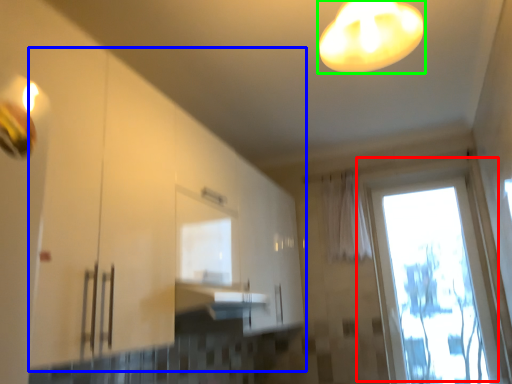
Question: Which is nearer to the window (highlighted by a red box)? cabinetry (highlighted by a blue box) or lamp (highlighted by a green box).

Choices:
 (A) cabinetry
 (B) lamp

Answer: (A)